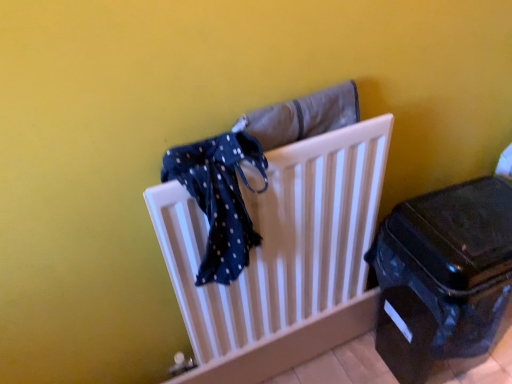
Question: Considering the relative sizes of blue dotted fabric at center and shiny black suitcase at lower right in the image provided, is blue dotted fabric at center wider than shiny black suitcase at lower right?

Choices:
 (A) no
 (B) yes

Answer: (A)

Question: Is blue dotted fabric at center at the left side of shiny black suitcase at lower right?

Choices:
 (A) yes
 (B) no

Answer: (A)

Question: Does blue dotted fabric at center turn towards shiny black suitcase at lower right?

Choices:
 (A) no
 (B) yes

Answer: (A)

Question: From a real-world perspective, is blue dotted fabric at center physically above shiny black suitcase at lower right?

Choices:
 (A) no
 (B) yes

Answer: (B)

Question: Is blue dotted fabric at center far from shiny black suitcase at lower right?

Choices:
 (A) yes
 (B) no

Answer: (B)

Question: Considering the relative sizes of blue dotted fabric at center and shiny black suitcase at lower right in the image provided, is blue dotted fabric at center smaller than shiny black suitcase at lower right?

Choices:
 (A) no
 (B) yes

Answer: (B)

Question: Is shiny black suitcase at lower right facing towards blue dotted fabric at center?

Choices:
 (A) yes
 (B) no

Answer: (B)

Question: From a real-world perspective, is shiny black suitcase at lower right on top of blue dotted fabric at center?

Choices:
 (A) yes
 (B) no

Answer: (B)

Question: Can you confirm if shiny black suitcase at lower right is shorter than blue dotted fabric at center?

Choices:
 (A) yes
 (B) no

Answer: (B)

Question: Is shiny black suitcase at lower right positioned behind blue dotted fabric at center?

Choices:
 (A) no
 (B) yes

Answer: (B)

Question: From the image's perspective, is shiny black suitcase at lower right located above blue dotted fabric at center?

Choices:
 (A) no
 (B) yes

Answer: (A)

Question: Can you see shiny black suitcase at lower right touching blue dotted fabric at center?

Choices:
 (A) yes
 (B) no

Answer: (B)

Question: From the image's perspective, is white plastic radiator at center over blue dotted fabric at center?

Choices:
 (A) yes
 (B) no

Answer: (B)